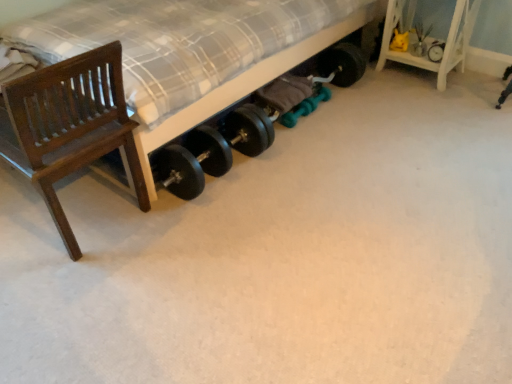
Question: Which is correct: white wood shelf at upper right is inside black rubber tire at upper right, or outside of it?

Choices:
 (A) inside
 (B) outside

Answer: (B)

Question: From the image's perspective, relative to black rubber tire at upper right, is white wood shelf at upper right above or below?

Choices:
 (A) above
 (B) below

Answer: (A)

Question: Which of these objects is positioned farthest from the black rubber tire at upper right?

Choices:
 (A) dark wood chair at left
 (B) white wood shelf at upper right
 (C) matte black dumbbells at lower center

Answer: (A)

Question: Which of these objects is positioned closest to the white wood shelf at upper right?

Choices:
 (A) black rubber tire at upper right
 (B) dark wood chair at left
 (C) matte black dumbbells at lower center

Answer: (A)